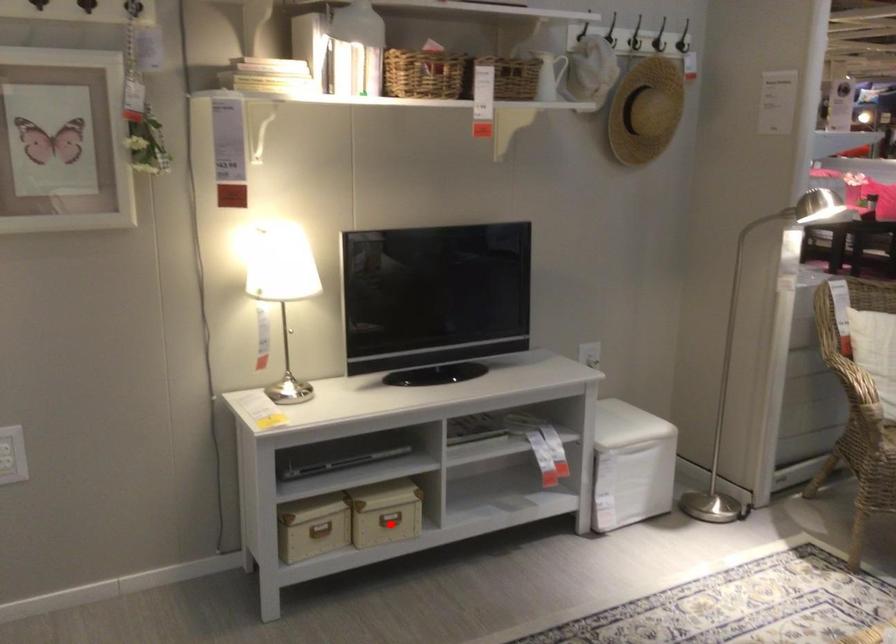
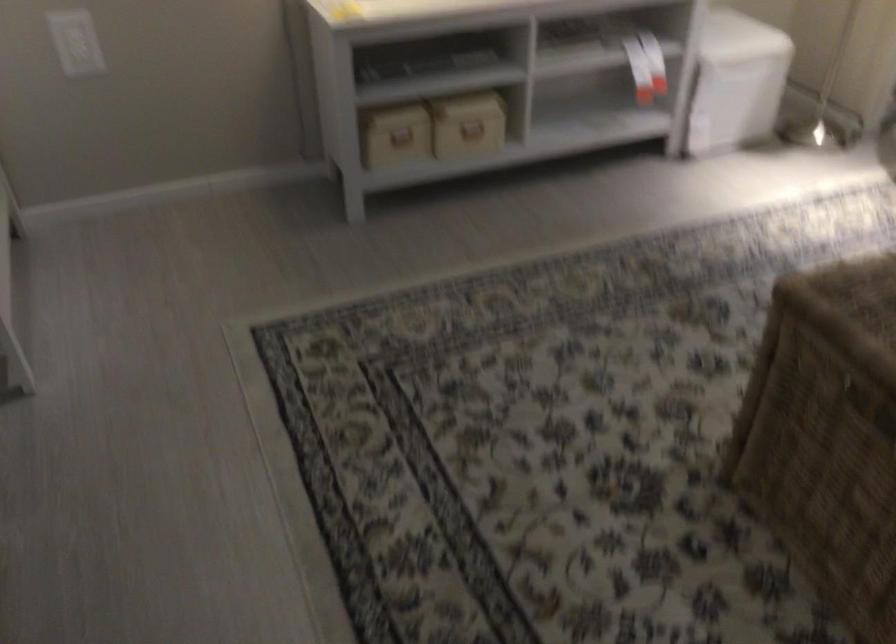
Find the pixel in the second image that matches the highlighted location in the first image.

(472, 131)